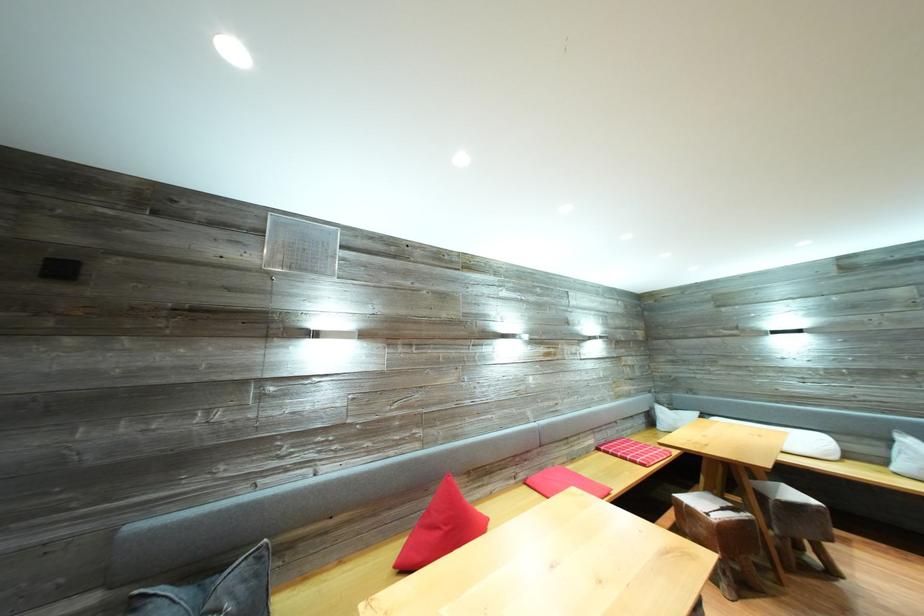
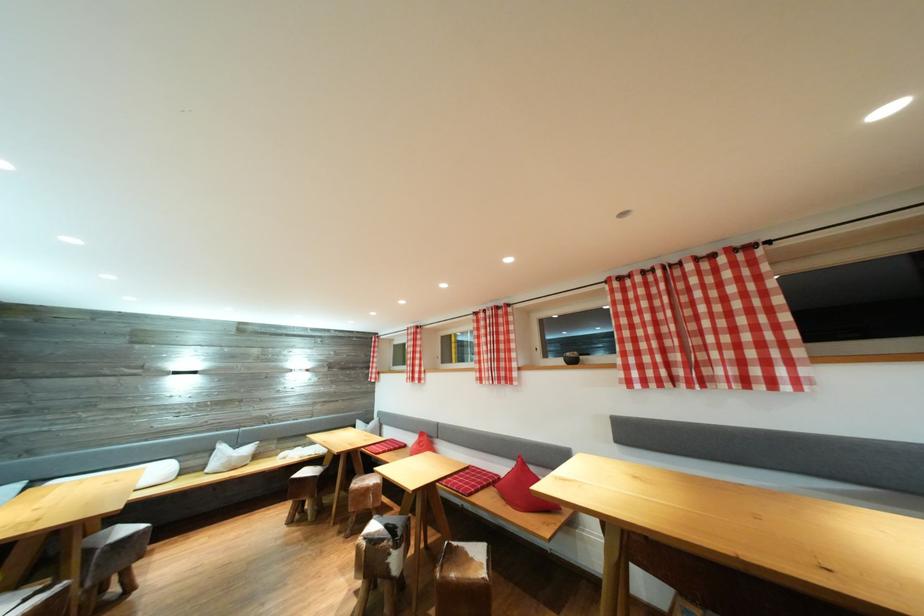
The point at (812, 453) is marked in the first image. Where is the corresponding point in the second image?

(161, 483)